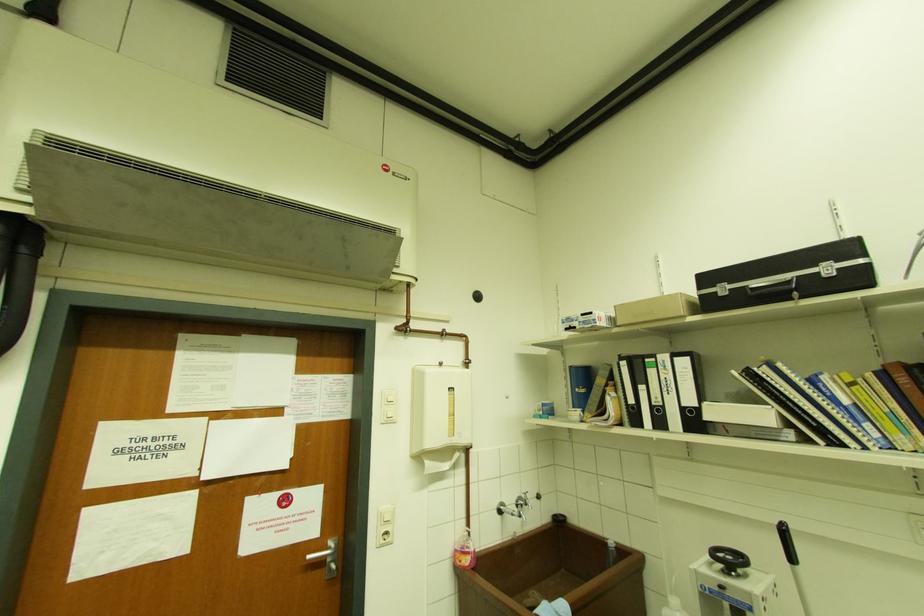
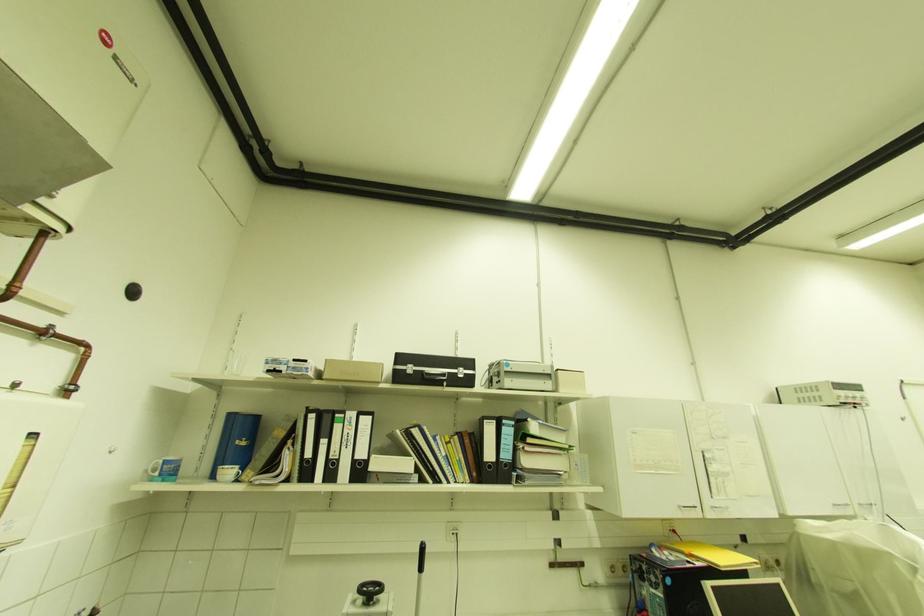
Based on the continuous images, in which direction is the camera rotating?

The camera rotated toward right-up.